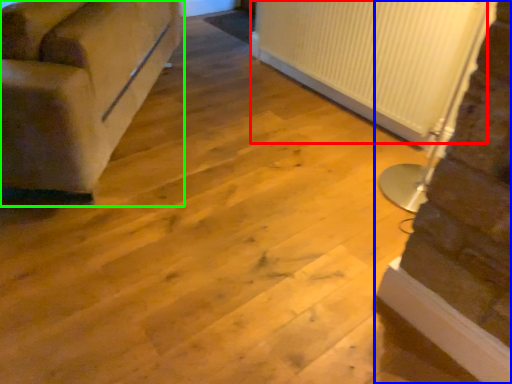
Question: Which object is positioned closest to radiator (highlighted by a red box)? Select from stairwell (highlighted by a blue box) and studio couch (highlighted by a green box).

Choices:
 (A) stairwell
 (B) studio couch

Answer: (A)